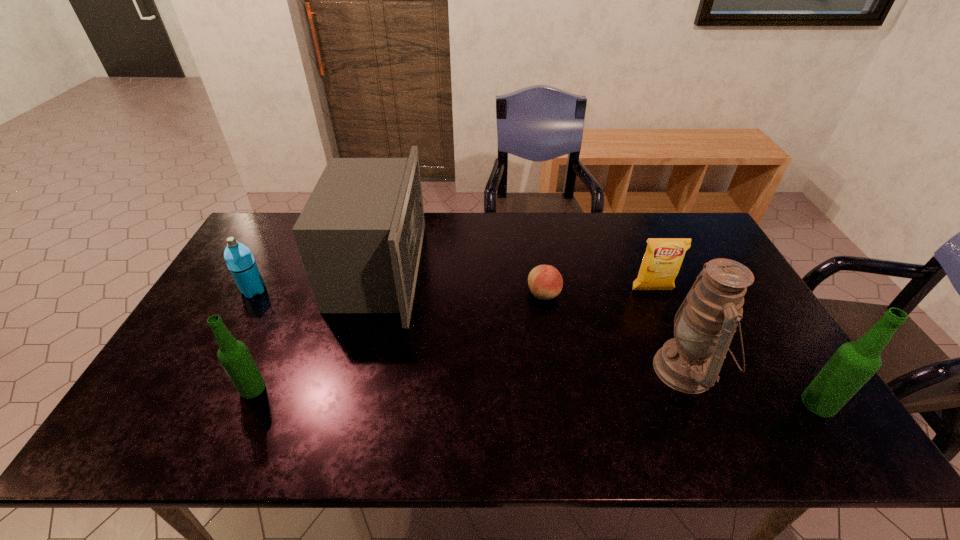
Where is `vacant space that satisfies the following two spatial constraints: 1. on the front side of the shortest object; 2. on the label of the left beer bottle`? vacant space that satisfies the following two spatial constraints: 1. on the front side of the shortest object; 2. on the label of the left beer bottle is located at coordinates (559, 388).